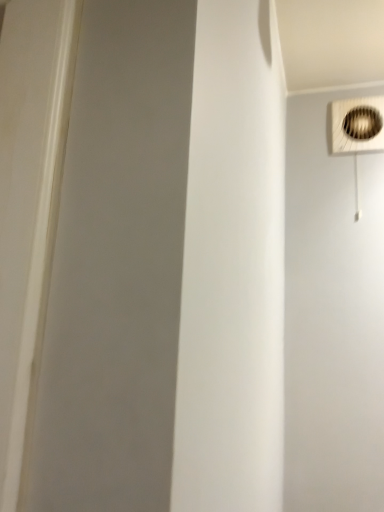
Image resolution: width=384 pixels, height=512 pixels. I want to click on white plastic mechanical fan at upper right, so click(357, 131).

Describe the element at coordinates (357, 131) in the screenshot. The image size is (384, 512). I see `white plastic mechanical fan at upper right` at that location.

Find the location of `white plastic mechanical fan at upper right`. white plastic mechanical fan at upper right is located at coordinates (357, 131).